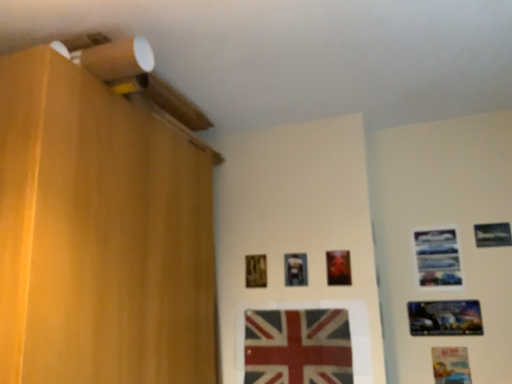
Question: Relative to metallic silver picture frame at upper right, which ranks as the fourth picture frame in right-to-left order, is metallic reflective poster at lower right, placed as the 5th picture frame when sorted from left to right, in front or behind?

Choices:
 (A) behind
 (B) front

Answer: (B)

Question: From the image's perspective, is metallic reflective poster at lower right, placed as the 5th picture frame when sorted from left to right, above or below metallic silver picture frame at upper right, marked as the fourth picture frame in a left-to-right arrangement?

Choices:
 (A) above
 (B) below

Answer: (B)

Question: Based on their relative distances, which object is farther from the matte plastic picture frame at lower right, which is counted as the sixth picture frame, starting from the left?

Choices:
 (A) metallic reflective poster at lower right, placed as the 5th picture frame when sorted from left to right
 (B) metallic silver picture frame at upper right, the 7th picture frame viewed from the left
 (C) red fabric flag at center
 (D) wooden picture frame at center, which is counted as the 5th picture frame, starting from the right
 (E) wooden picture frame at center, the seventh picture frame positioned from the right

Answer: (E)

Question: Which object is the closest to the metallic silver picture frame at upper right, which ranks as the fourth picture frame in right-to-left order?

Choices:
 (A) matte plastic picture frame at lower right, arranged as the second picture frame when viewed from the right
 (B) wooden picture frame at center, the seventh picture frame positioned from the right
 (C) metallic silver picture frame at upper right, the 7th picture frame viewed from the left
 (D) metallic silver picture frame at center, the second picture frame from the left
 (E) wooden picture frame at center, which appears as the 3th picture frame when viewed from the left

Answer: (C)